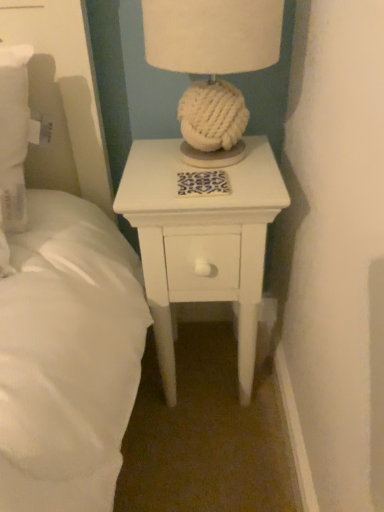
Where is `free location above white painted wood nightstand at center (from a real-world perspective)`? This screenshot has width=384, height=512. free location above white painted wood nightstand at center (from a real-world perspective) is located at coordinates (193, 173).